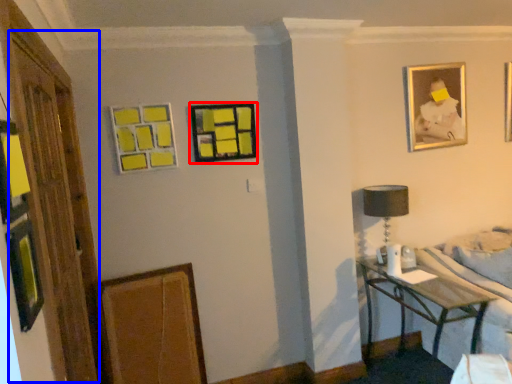
Question: Which of the following is the farthest to the observer, picture frame (highlighted by a red box) or glass door (highlighted by a blue box)?

Choices:
 (A) picture frame
 (B) glass door

Answer: (A)